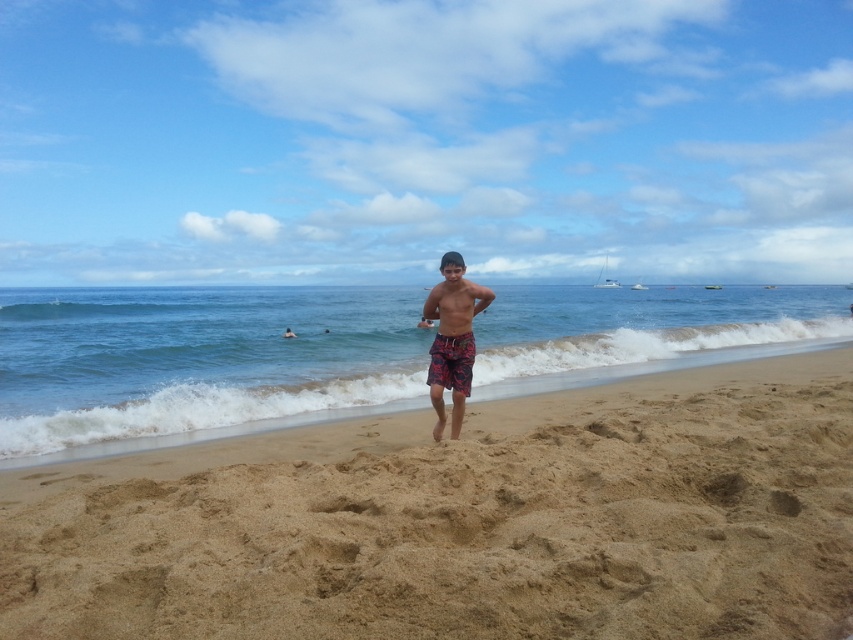
Question: Which point is closer to the camera taking this photo?

Choices:
 (A) pyautogui.click(x=450, y=337)
 (B) pyautogui.click(x=485, y=291)
 (C) pyautogui.click(x=436, y=385)

Answer: (C)

Question: Is floral cotton shorts at center below dark blue swim trunks at center?

Choices:
 (A) yes
 (B) no

Answer: (A)

Question: Estimate the real-world distances between objects in this image. Which object is farther from the floral cotton shorts at center?

Choices:
 (A) dark blue swim trunks at center
 (B) printed cotton shorts at center
 (C) printed fabric shorts at center

Answer: (A)

Question: Which of the following is the closest to the observer?

Choices:
 (A) (479, 289)
 (B) (286, 326)
 (C) (463, 291)
 (D) (453, 376)

Answer: (C)

Question: Does printed cotton shorts at center have a larger size compared to floral cotton shorts at center?

Choices:
 (A) no
 (B) yes

Answer: (B)

Question: Does printed fabric shorts at center have a smaller size compared to dark blue swim trunks at center?

Choices:
 (A) no
 (B) yes

Answer: (B)